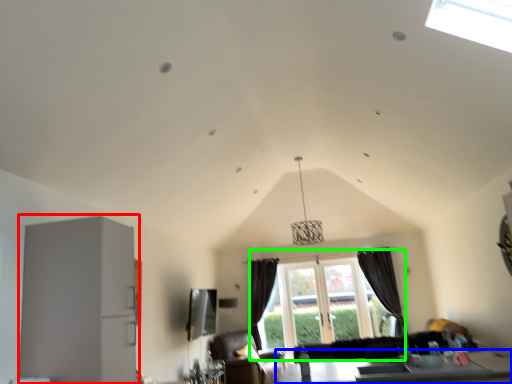
Question: Which object is the farthest from appliance (highlighted by a red box)? Choose among these: table (highlighted by a blue box) or window (highlighted by a green box).

Choices:
 (A) table
 (B) window

Answer: (B)